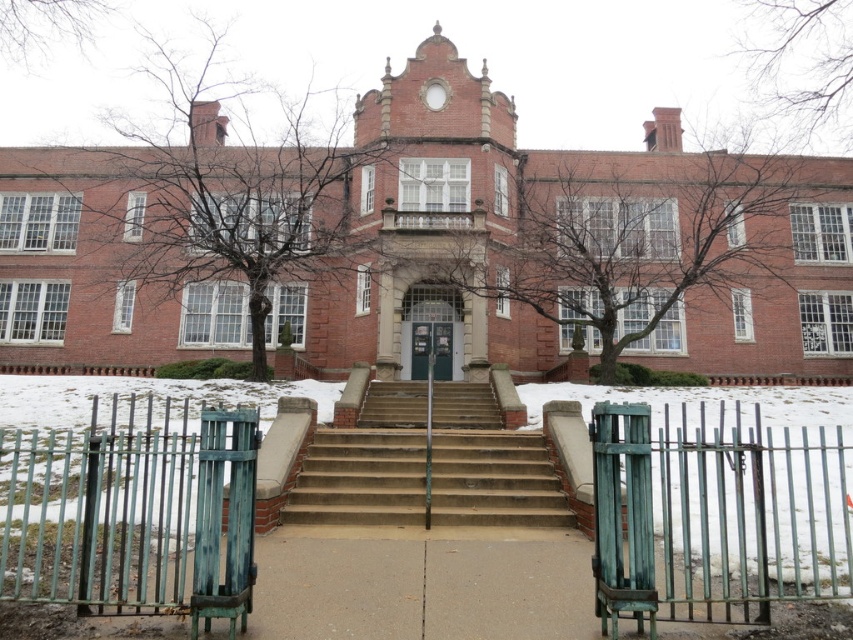
Who is positioned more to the left, green patina metal gate at lower left or brown concrete stairs at center?

green patina metal gate at lower left is more to the left.

Is green patina metal gate at lower left wider than brown concrete stairs at center?

No, green patina metal gate at lower left is not wider than brown concrete stairs at center.

Which is in front, point (218, 509) or point (469, 480)?

Positioned in front is point (218, 509).

Locate an element on the screen. The width and height of the screenshot is (853, 640). green patina metal gate at lower left is located at coordinates (134, 512).

Does green patina metal gate at lower right have a greater width compared to brown concrete stairs at center?

Indeed, green patina metal gate at lower right has a greater width compared to brown concrete stairs at center.

Does point (657, 483) lie behind point (450, 490)?

Yes, it is.

Measure the distance between green patina metal gate at lower right and camera.

green patina metal gate at lower right is 4.75 meters from camera.

Identify the location of green patina metal gate at lower right. This screenshot has height=640, width=853. (714, 516).

Can you confirm if green patina metal gate at lower left is bigger than green patina metal gate at lower right?

Actually, green patina metal gate at lower left might be smaller than green patina metal gate at lower right.

Which is in front, point (120, 548) or point (778, 492)?

Point (120, 548) is more forward.

Locate an element on the screen. The height and width of the screenshot is (640, 853). green patina metal gate at lower left is located at coordinates (134, 512).